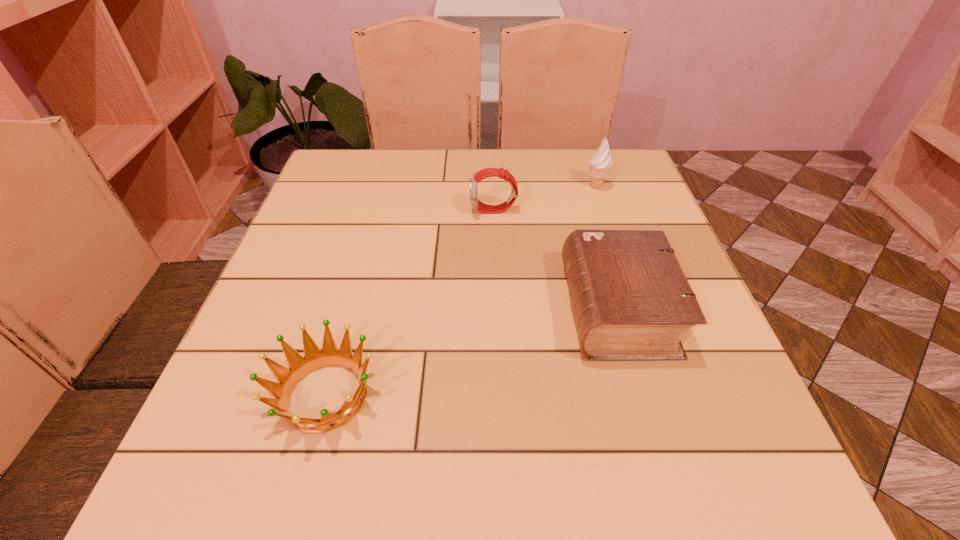
In order to click on vacant space situated 0.130m on the face of the second object from left to right in this screenshot , I will do `click(418, 211)`.

This screenshot has width=960, height=540. In order to click on free space located on the face of the second object from left to right in this screenshot , I will do `click(324, 211)`.

Find the location of `free space located on the face of the second object from left to right`. free space located on the face of the second object from left to right is located at coordinates (401, 211).

Image resolution: width=960 pixels, height=540 pixels. I want to click on vacant space situated 0.190m on the spine side of the Bible, so click(468, 309).

This screenshot has width=960, height=540. Identify the location of vacant space located on the spine side of the Bible. (422, 309).

The image size is (960, 540). Find the location of `vacant point located 0.350m on the spine side of the Bible`. vacant point located 0.350m on the spine side of the Bible is located at coordinates (386, 309).

Identify the location of vacant point located on the back of the shortest object. (374, 217).

The width and height of the screenshot is (960, 540). Find the location of `object present at the far edge`. object present at the far edge is located at coordinates (600, 163).

Locate an element on the screen. The width and height of the screenshot is (960, 540). object at the near edge is located at coordinates (299, 367).

At what (x,y) coordinates should I click in order to perform the action: click on object positioned at the left edge. Please return your answer as a coordinate pair (x, y). The height and width of the screenshot is (540, 960). Looking at the image, I should click on (299, 367).